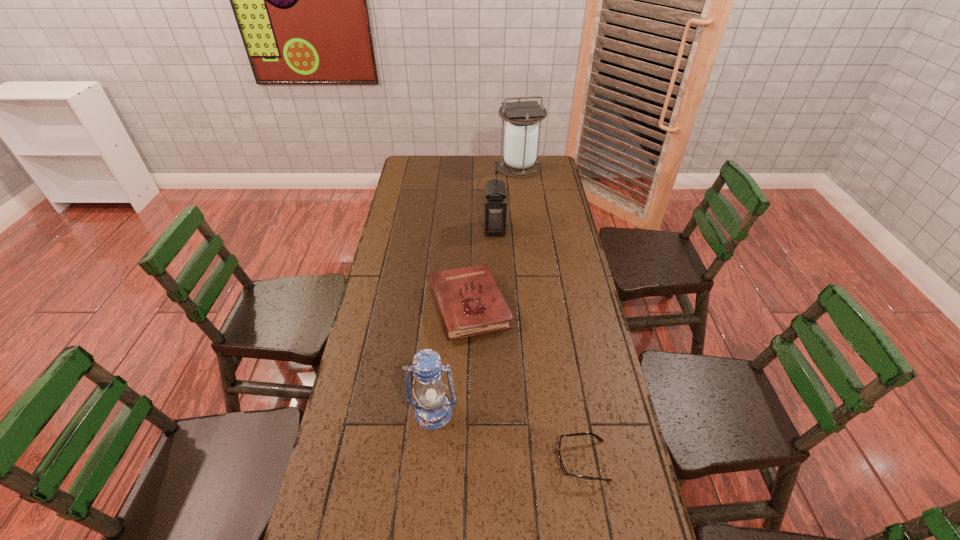
Image resolution: width=960 pixels, height=540 pixels. In order to click on blank space located on the front-facing side of the fourth nearest object in this screenshot , I will do `click(415, 228)`.

At what (x,y) coordinates should I click in order to perform the action: click on free location located 0.160m on the front-facing side of the fourth nearest object. Please return your answer as a coordinate pair (x, y). Looking at the image, I should click on (445, 228).

Locate an element on the screen. This screenshot has width=960, height=540. free location located on the front-facing side of the fourth nearest object is located at coordinates (396, 228).

Identify the location of vacant position located on the front-facing side of the leftmost lantern. (427, 487).

Locate an element on the screen. This screenshot has width=960, height=540. vacant space situated 0.170m on the left of the second shortest object is located at coordinates (378, 306).

The height and width of the screenshot is (540, 960). Find the location of `free region located on the front-facing side of the spectacles`. free region located on the front-facing side of the spectacles is located at coordinates 445,461.

Identify the location of vacant space situated on the front-facing side of the spectacles. The width and height of the screenshot is (960, 540). pyautogui.click(x=477, y=461).

Locate an element on the screen. vacant space located on the front-facing side of the spectacles is located at coordinates (519, 461).

Where is `object at the far edge`? This screenshot has height=540, width=960. object at the far edge is located at coordinates (521, 132).

Where is `lantern at the right edge`? lantern at the right edge is located at coordinates (521, 132).